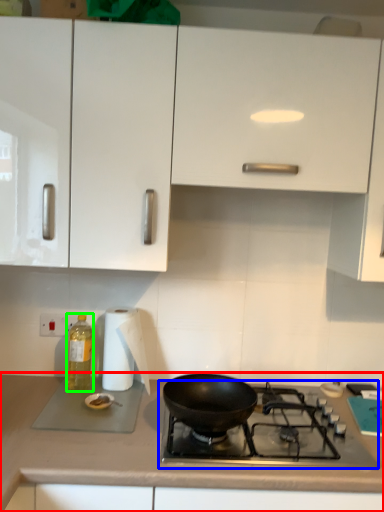
Question: Considering the real-world distances, which object is closest to countertop (highlighted by a red box)? gas stove (highlighted by a blue box) or bottle (highlighted by a green box).

Choices:
 (A) gas stove
 (B) bottle

Answer: (A)